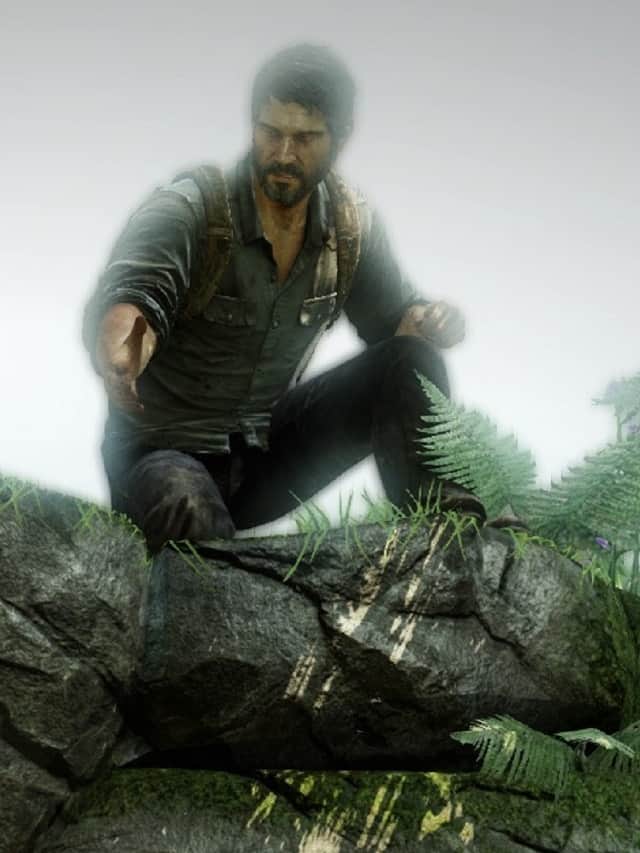
Locate an element on the screen. The height and width of the screenshot is (853, 640). the chest is located at coordinates (284, 269).